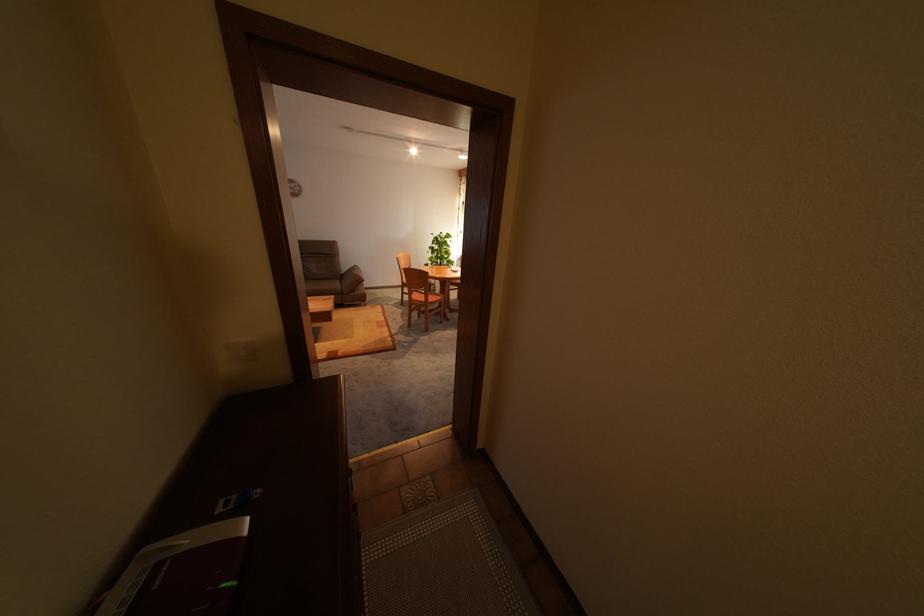
The width and height of the screenshot is (924, 616). What do you see at coordinates (240, 352) in the screenshot? I see `the white light switch` at bounding box center [240, 352].